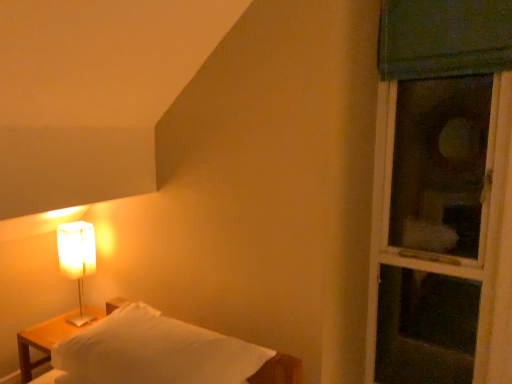
Question: In terms of size, does white matte bed at lower left appear bigger or smaller than green fabric window at right?

Choices:
 (A) big
 (B) small

Answer: (B)

Question: Is white matte bed at lower left to the left or to the right of green fabric window at right in the image?

Choices:
 (A) right
 (B) left

Answer: (B)

Question: Which of these objects is positioned farthest from the wooden nightstand at left?

Choices:
 (A) green fabric window at right
 (B) white matte rectangular lamp at left
 (C) white matte bed at lower left

Answer: (A)

Question: Estimate the real-world distances between objects in this image. Which object is farther from the green fabric window at right?

Choices:
 (A) white matte bed at lower left
 (B) white matte rectangular lamp at left
 (C) wooden nightstand at left

Answer: (C)